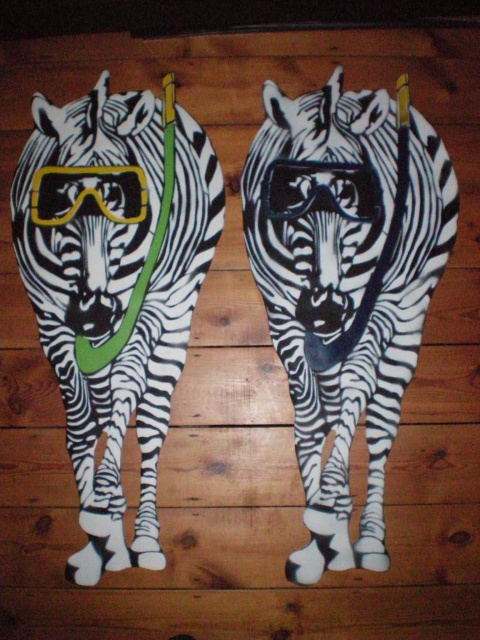
Looking at this image, you are designing a poster and want to place both the matte black zebra at left and the yellow matte goggles at center on the same line. Given their sizes, which object should you scale down to ensure they fit proportionally?

The matte black zebra at left is larger than the yellow matte goggles at center, so you should scale down the matte black zebra at left to ensure they fit proportionally.

You are an optometrist examining the black matte goggles at center and the yellow matte goggles at center. Which pair has a narrower frame?

The black matte goggles at center has a thinner frame than the yellow matte goggles at center according to the description.

You are standing in front of the two zebra cutouts. You notice two specific points marked in the scene. The first point is at coordinates point (287, 202) and the second is at point (33, 214). Which point is closer to you?

Point (33, 214) is closer to you because it is in front of point (287, 202) according to their spatial arrangement.